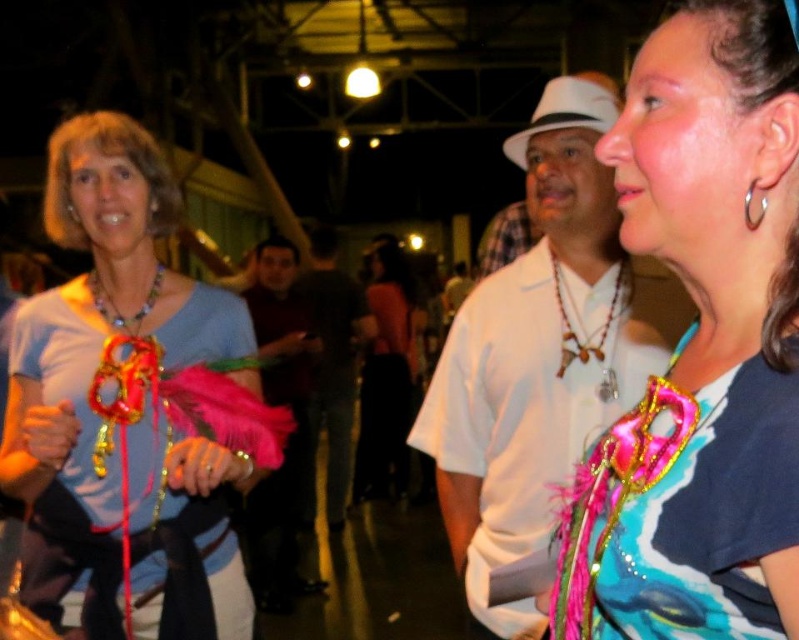
From the picture: Does white matte shirt at center have a larger size compared to multicolored beaded necklace at upper left?

Correct, white matte shirt at center is larger in size than multicolored beaded necklace at upper left.

Is white matte shirt at center above multicolored beaded necklace at upper left?

No, white matte shirt at center is not above multicolored beaded necklace at upper left.

Who is more forward, (565, 150) or (113, 308)?

Point (113, 308) is in front.

At what (x,y) coordinates should I click in order to perform the action: click on white matte shirt at center. Please return your answer as a coordinate pair (x, y). Image resolution: width=799 pixels, height=640 pixels. Looking at the image, I should click on (535, 355).

Can you confirm if matte blue shirt at left is positioned to the left of white matte shirt at center?

Correct, you'll find matte blue shirt at left to the left of white matte shirt at center.

Does point (44, 544) lie behind point (586, 83)?

No, it is in front of (586, 83).

Who is more distant from viewer, (114, 170) or (535, 372)?

A: Positioned behind is point (535, 372).

The height and width of the screenshot is (640, 799). Identify the location of matte blue shirt at left. (124, 467).

Which is more to the left, shiny pink feather boa at center or white matte shirt at center?

shiny pink feather boa at center is more to the left.

Is shiny pink feather boa at center positioned at the back of white matte shirt at center?

No, it is in front of white matte shirt at center.

Locate an element on the screen. This screenshot has width=799, height=640. shiny pink feather boa at center is located at coordinates (702, 348).